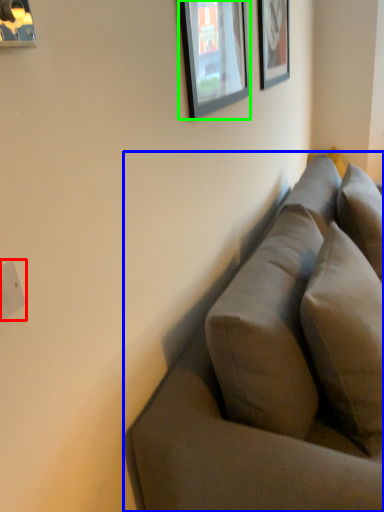
Question: Which is nearer to the electric outlet (highlighted by a red box)? studio couch (highlighted by a blue box) or picture frame (highlighted by a green box).

Choices:
 (A) studio couch
 (B) picture frame

Answer: (A)